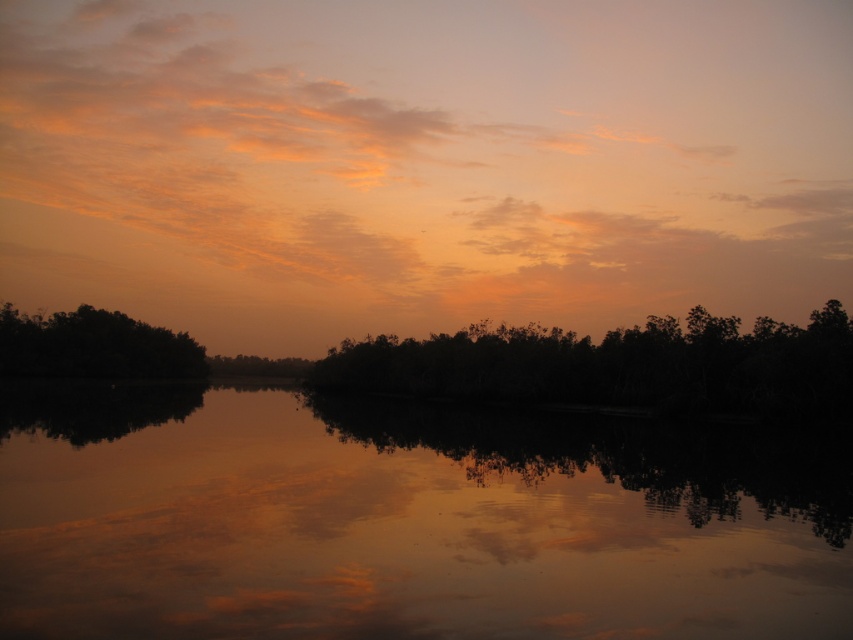
In the scene shown: Who is more distant from viewer, (326,376) or (86,324)?

The point (86,324) is more distant.

The height and width of the screenshot is (640, 853). Describe the element at coordinates (618, 365) in the screenshot. I see `silhouette trees at center` at that location.

Find the location of `silhouette trees at center`. silhouette trees at center is located at coordinates pyautogui.click(x=618, y=365).

Is the position of orange matte cloud at upper center more distant than that of dark green leafy trees at left?

No, it is in front of dark green leafy trees at left.

Does orange matte cloud at upper center appear on the right side of dark green leafy trees at left?

Indeed, orange matte cloud at upper center is positioned on the right side of dark green leafy trees at left.

Who is more forward, (223, 140) or (67, 348)?

Positioned in front is point (67, 348).

Where is `orange matte cloud at upper center`? orange matte cloud at upper center is located at coordinates (422, 163).

Does point (90, 486) come closer to viewer compared to point (312, 371)?

Yes, it is.

Find the location of a particular element. This screenshot has height=640, width=853. smooth reflective water at center is located at coordinates (405, 520).